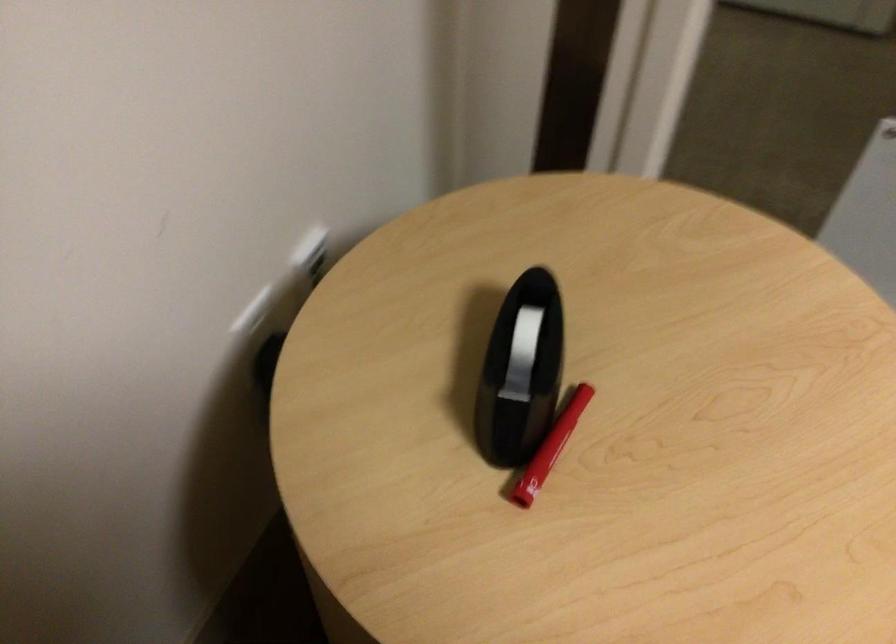
Where would you pull the red marker cap? Please return your answer as a coordinate pair (x, y).

(527, 511)